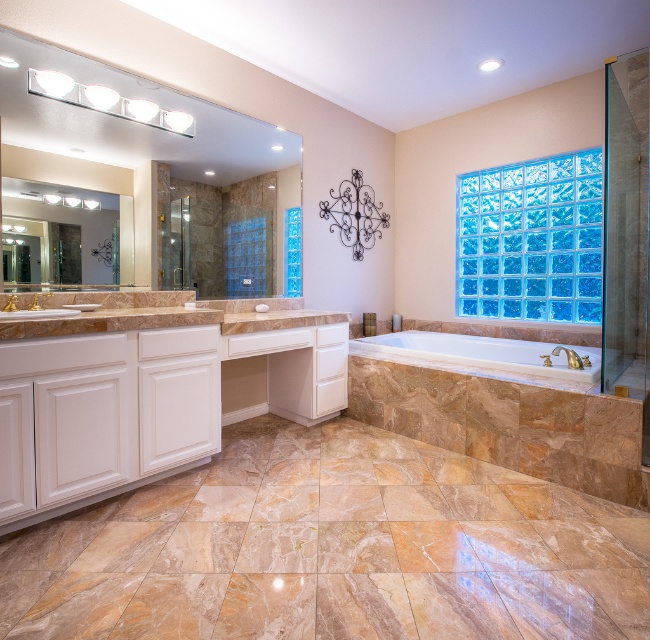
Question: Can you confirm if metallic wrought iron chandelier at upper center is smaller than gold metallic faucet at lower right?

Choices:
 (A) no
 (B) yes

Answer: (A)

Question: Can you confirm if blue glass block wall at upper right is positioned to the left of metallic wrought iron chandelier at upper center?

Choices:
 (A) yes
 (B) no

Answer: (B)

Question: Which point is farther to the camera?

Choices:
 (A) (552, 352)
 (B) (39, 307)
 (C) (62, 122)

Answer: (A)

Question: Which of the following is the farthest from the observer?

Choices:
 (A) (x=34, y=296)
 (B) (x=179, y=156)
 (C) (x=10, y=294)
 (D) (x=333, y=196)

Answer: (D)

Question: Is the position of blue glass block wall at upper right less distant than that of white marble bathtub at center?

Choices:
 (A) yes
 (B) no

Answer: (B)

Question: Based on their relative distances, which object is nearer to the matte glass mirror at upper left?

Choices:
 (A) gold metallic faucet at upper center
 (B) gold metallic faucet at center

Answer: (A)